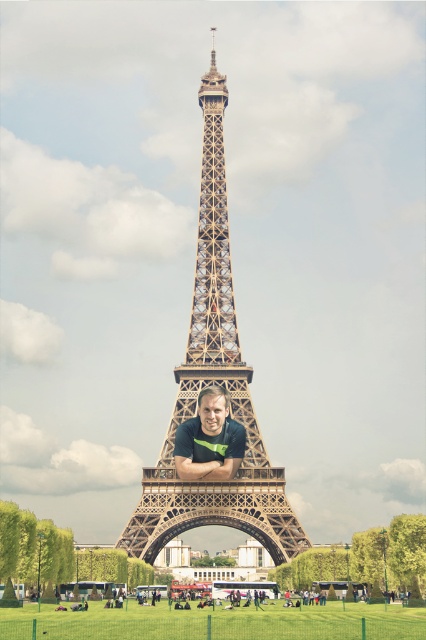
Question: Which point is closer to the camera taking this photo?

Choices:
 (A) (209, 392)
 (B) (198, 326)

Answer: (A)

Question: Does brown metal eiffel tower at center have a larger size compared to matte black shirt at center?

Choices:
 (A) yes
 (B) no

Answer: (A)

Question: Which point is farther from the camera taking this photo?

Choices:
 (A) (146, 490)
 (B) (199, 477)

Answer: (A)

Question: Is brown metal eiffel tower at center to the right of matte black shirt at center from the viewer's perspective?

Choices:
 (A) no
 (B) yes

Answer: (B)

Question: Is brown metal eiffel tower at center smaller than matte black shirt at center?

Choices:
 (A) no
 (B) yes

Answer: (A)